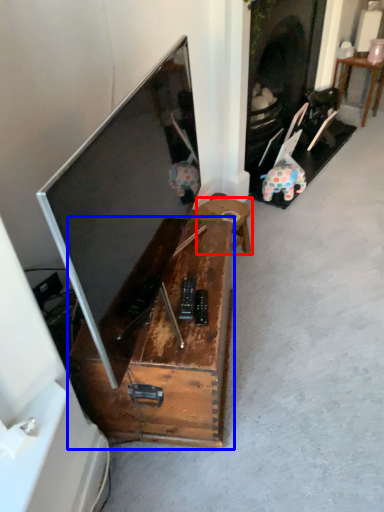
Question: Which point is closer to the camera, table (highlighted by a red box) or furniture (highlighted by a blue box)?

Choices:
 (A) table
 (B) furniture

Answer: (B)